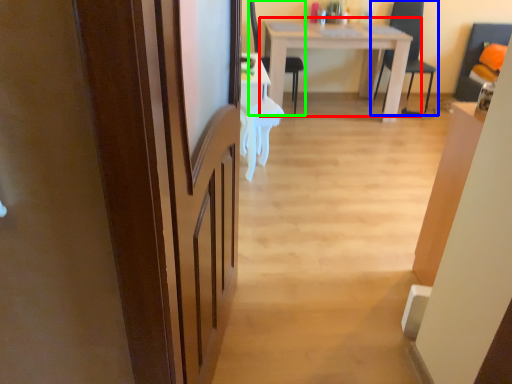
Question: Which object is positioned closest to table (highlighted by a red box)? Select from chair (highlighted by a blue box) and chair (highlighted by a green box).

Choices:
 (A) chair
 (B) chair

Answer: (B)